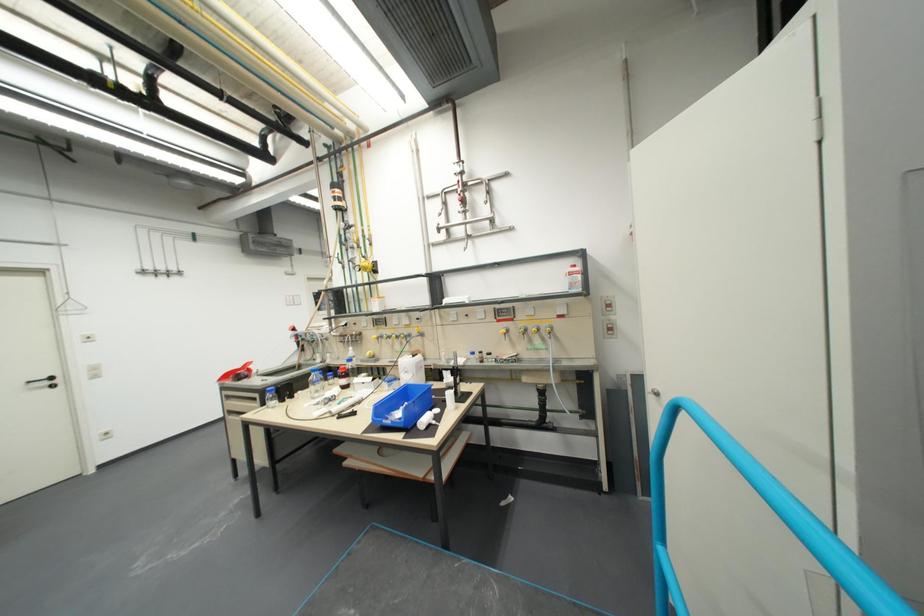
Find where to push the blue metal handle. Please return your answer as a coordinate pair (x, y).

(758, 522)